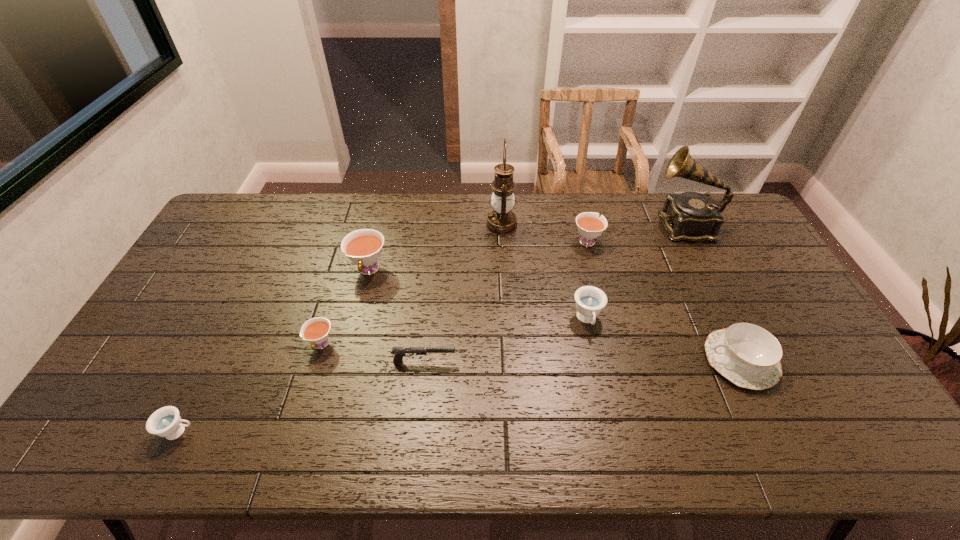
Locate an element on the screen. This screenshot has width=960, height=540. vacant space at the far left corner of the desktop is located at coordinates (269, 204).

In the image, there is a desktop. At what (x,y) coordinates should I click in order to perform the action: click on vacant area at the near left corner. Please return your answer as a coordinate pair (x, y). Looking at the image, I should click on (113, 437).

You are a GUI agent. You are given a task and a screenshot of the screen. Output one action in this format:
    pyautogui.click(x=<x>, y=<y>)
    Task: Click on the vacant region at the near right corner of the desktop
    Image resolution: width=960 pixels, height=540 pixels.
    Given the screenshot: What is the action you would take?
    pyautogui.click(x=852, y=425)

This screenshot has width=960, height=540. I want to click on vacant area between the fifth object from right to left and the second smallest white teacup, so click(544, 233).

Locate an element on the screen. This screenshot has height=540, width=960. unoccupied position between the nearer blue teacup and the rightmost white teacup is located at coordinates (383, 336).

This screenshot has width=960, height=540. What are the coordinates of `free area in between the farther blue teacup and the smallest white teacup` in the screenshot? It's located at (454, 332).

I want to click on free space between the eighth shortest object and the nearest white teacup, so click(503, 285).

At what (x,y) coordinates should I click in order to perform the action: click on vacant area that lies between the brown oil lamp and the farthest white teacup. Please return your answer as a coordinate pair (x, y). The width and height of the screenshot is (960, 540). Looking at the image, I should click on (544, 233).

Image resolution: width=960 pixels, height=540 pixels. Find the location of `blank region between the farthest teacup and the phonograph record`. blank region between the farthest teacup and the phonograph record is located at coordinates (636, 233).

The image size is (960, 540). Find the location of `vacant point located between the second farthest teacup and the eighth shortest object`. vacant point located between the second farthest teacup and the eighth shortest object is located at coordinates (526, 248).